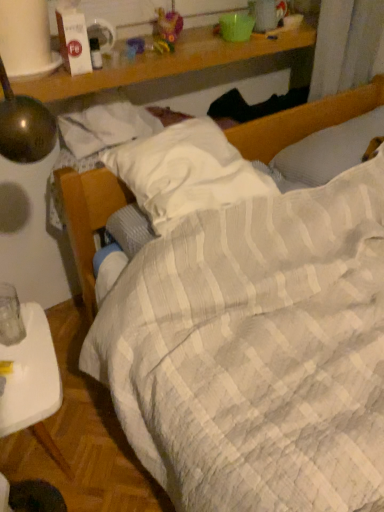
Question: Relative to white plastic tray at lower left, is white textured pillow at upper right, marked as the 2th pillow in a left-to-right arrangement, in front or behind?

Choices:
 (A) front
 (B) behind

Answer: (B)

Question: Is white textured pillow at upper right, marked as the 2th pillow in a left-to-right arrangement, inside or outside of white plastic tray at lower left?

Choices:
 (A) outside
 (B) inside

Answer: (A)

Question: Estimate the real-world distances between objects in this image. Which object is closer to the white quilted pillow at center, which is the first pillow from left to right?

Choices:
 (A) white plastic tray at lower left
 (B) white textured pillow at upper right, marked as the 2th pillow in a left-to-right arrangement

Answer: (B)

Question: Which of these objects is positioned farthest from the white textured pillow at upper right, which ranks as the 1th pillow in right-to-left order?

Choices:
 (A) white quilted pillow at center, the second pillow when ordered from right to left
 (B) white plastic tray at lower left

Answer: (B)